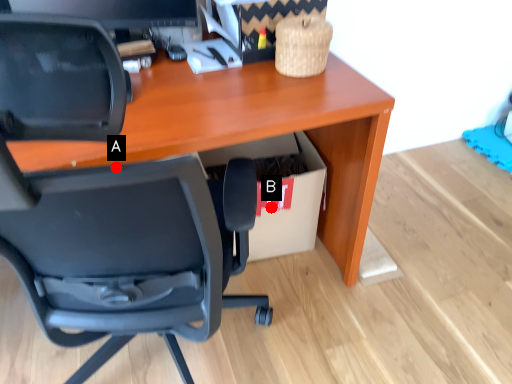
Question: Two points are circled on the image, labeled by A and B beside each circle. Which point is further to the camera?

Choices:
 (A) A is further
 (B) B is further

Answer: (B)